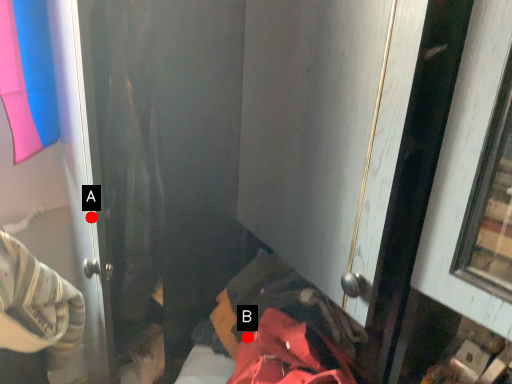
Question: Two points are circled on the image, labeled by A and B beside each circle. Which point appears closest to the camera in this image?

Choices:
 (A) A is closer
 (B) B is closer

Answer: (A)